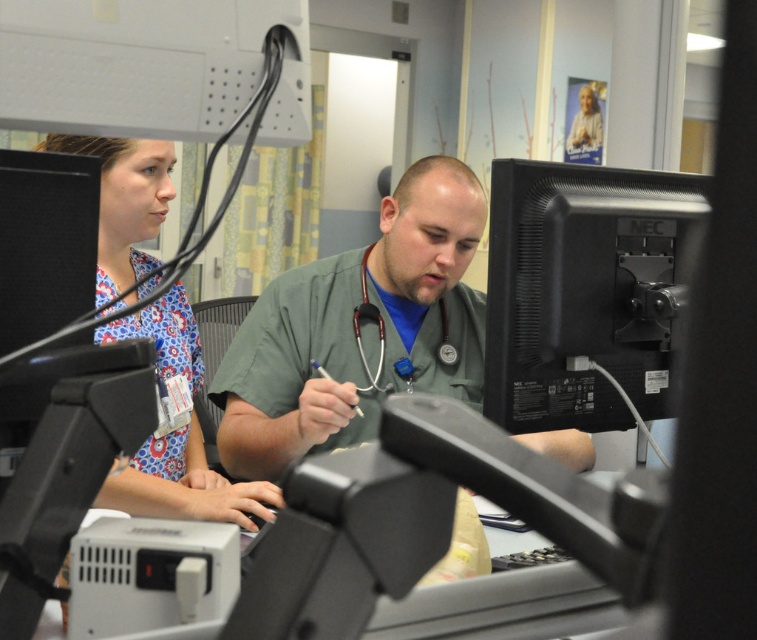
This screenshot has height=640, width=757. What do you see at coordinates (357, 330) in the screenshot? I see `green scrubs at center` at bounding box center [357, 330].

Who is taller, green scrubs at center or wooden stethoscope at center?

green scrubs at center is taller.

Where is `green scrubs at center`? The image size is (757, 640). green scrubs at center is located at coordinates (357, 330).

Can you confirm if green scrubs at center is thinner than blue printed scrubs at left?

In fact, green scrubs at center might be wider than blue printed scrubs at left.

What do you see at coordinates (357, 330) in the screenshot? I see `green scrubs at center` at bounding box center [357, 330].

Where is `green scrubs at center`? green scrubs at center is located at coordinates (357, 330).

Find the location of a particular element. This screenshot has width=757, height=640. blue printed scrubs at left is located at coordinates (123, 202).

Can you confirm if blue printed scrubs at left is bigger than wooden stethoscope at center?

Yes.

Image resolution: width=757 pixels, height=640 pixels. What do you see at coordinates (123, 202) in the screenshot? I see `blue printed scrubs at left` at bounding box center [123, 202].

Locate an element on the screen. The height and width of the screenshot is (640, 757). blue printed scrubs at left is located at coordinates (123, 202).